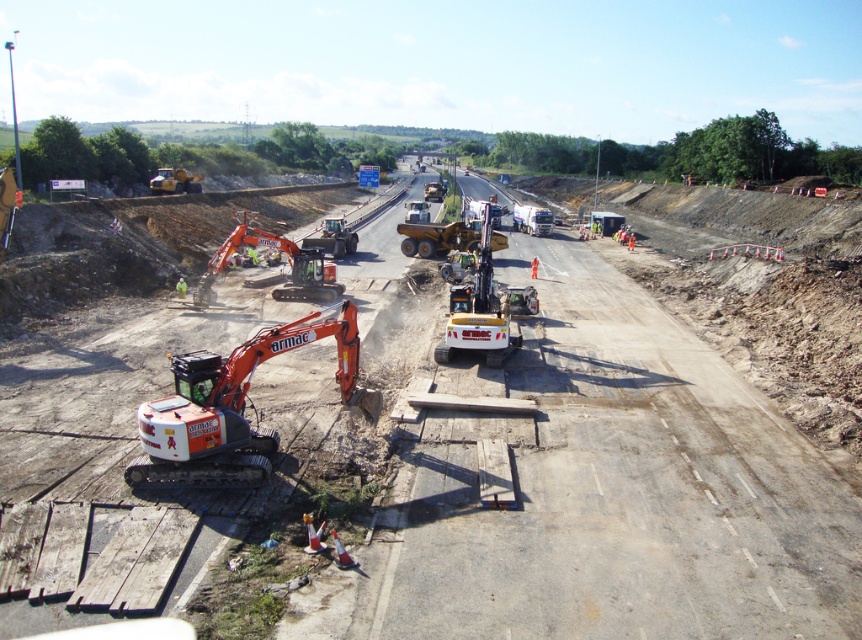
Question: Is the position of yellow metallic forklift at center less distant than that of yellow metallic dump truck at center?

Choices:
 (A) no
 (B) yes

Answer: (B)

Question: Which point is farther from the camera taking this photo?

Choices:
 (A) (547, 208)
 (B) (488, 337)
 (C) (322, 324)

Answer: (A)

Question: Which point is closer to the camera taking this photo?

Choices:
 (A) (357, 333)
 (B) (553, 218)

Answer: (A)

Question: Is yellow metallic forklift at center wider than orange rubber tracked excavator at left?

Choices:
 (A) yes
 (B) no

Answer: (B)

Question: Which point appears farthest from the camera in this image?

Choices:
 (A) (515, 216)
 (B) (439, 342)
 (C) (210, 456)

Answer: (A)

Question: Is yellow metallic dump truck at center thinner than white plastic truck at center?

Choices:
 (A) yes
 (B) no

Answer: (B)